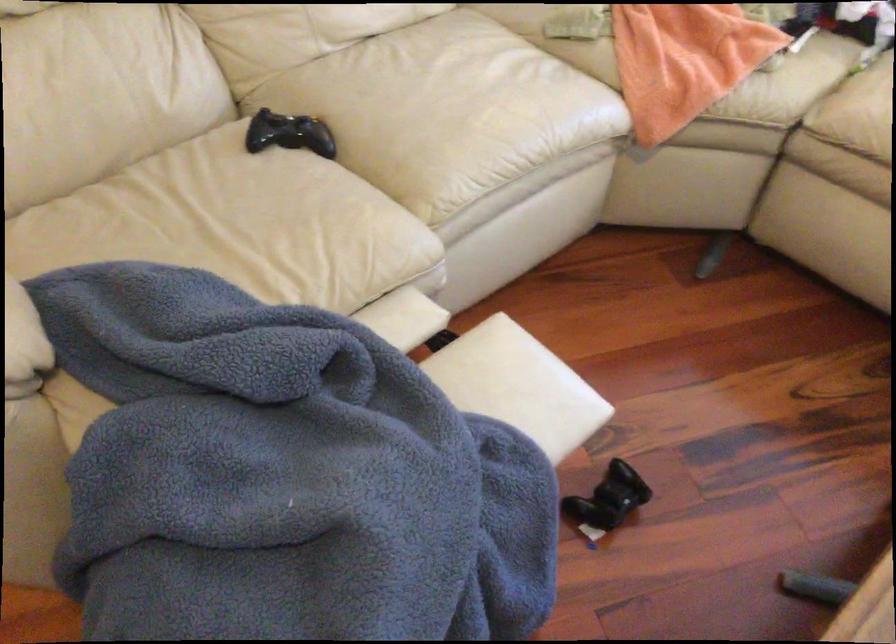
Find where to sit the sofa sitting surface. Please return your answer as a coordinate pair (x, y).

(446, 109)